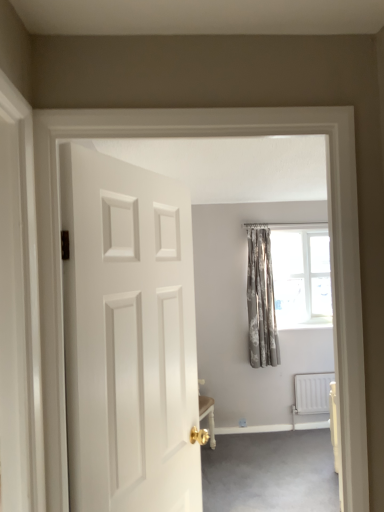
Question: From the image's perspective, is white metallic radiator at lower right below patterned fabric curtain at upper right?

Choices:
 (A) yes
 (B) no

Answer: (A)

Question: Is white metallic radiator at lower right turned away from patterned fabric curtain at upper right?

Choices:
 (A) no
 (B) yes

Answer: (A)

Question: Is white metallic radiator at lower right smaller than patterned fabric curtain at upper right?

Choices:
 (A) no
 (B) yes

Answer: (B)

Question: From the image's perspective, is white metallic radiator at lower right on top of patterned fabric curtain at upper right?

Choices:
 (A) no
 (B) yes

Answer: (A)

Question: Would you say white metallic radiator at lower right contains patterned fabric curtain at upper right?

Choices:
 (A) no
 (B) yes

Answer: (A)

Question: From a real-world perspective, is white matte door at center positioned above or below white metallic radiator at lower right?

Choices:
 (A) below
 (B) above

Answer: (B)

Question: Choose the correct answer: Is white matte door at center inside white metallic radiator at lower right or outside it?

Choices:
 (A) inside
 (B) outside

Answer: (B)

Question: In the image, is white matte door at center on the left side or the right side of white metallic radiator at lower right?

Choices:
 (A) left
 (B) right

Answer: (A)

Question: From the image's perspective, relative to white metallic radiator at lower right, is white matte door at center above or below?

Choices:
 (A) below
 (B) above

Answer: (B)

Question: Do you think silver textured curtains at center is within patterned fabric curtain at upper right, or outside of it?

Choices:
 (A) outside
 (B) inside

Answer: (A)

Question: Looking at their shapes, would you say silver textured curtains at center is wider or thinner than patterned fabric curtain at upper right?

Choices:
 (A) wide
 (B) thin

Answer: (A)

Question: In the image, is silver textured curtains at center on the left side or the right side of patterned fabric curtain at upper right?

Choices:
 (A) right
 (B) left

Answer: (B)

Question: Considering the positions of silver textured curtains at center and patterned fabric curtain at upper right in the image, is silver textured curtains at center bigger or smaller than patterned fabric curtain at upper right?

Choices:
 (A) small
 (B) big

Answer: (A)

Question: Looking at their shapes, would you say white matte door at center is wider or thinner than carpet at lower right?

Choices:
 (A) wide
 (B) thin

Answer: (B)

Question: Considering their positions, is white matte door at center located in front of or behind carpet at lower right?

Choices:
 (A) front
 (B) behind

Answer: (A)